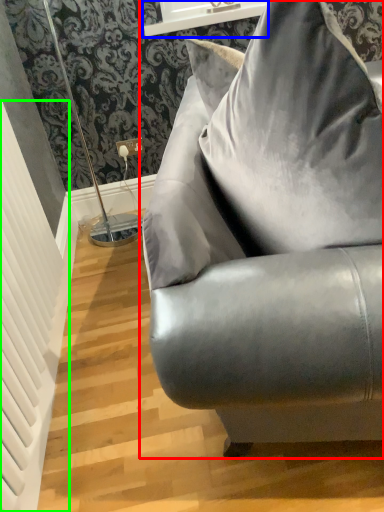
Question: Which object is the closest to the studio couch (highlighted by a red box)? Choose among these: window sill (highlighted by a blue box) or radiator (highlighted by a green box).

Choices:
 (A) window sill
 (B) radiator

Answer: (B)